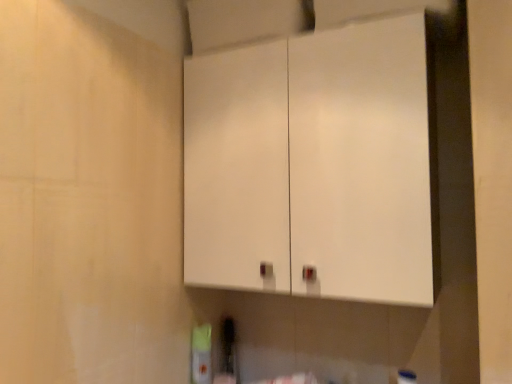
What do you see at coordinates (312, 165) in the screenshot? I see `white matte cabinet at upper center` at bounding box center [312, 165].

In the scene shown: Measure the distance between point [271,253] and camera.

The distance of point [271,253] from camera is 39.02 inches.

The height and width of the screenshot is (384, 512). What are the coordinates of `white matte cabinet at upper center` in the screenshot? It's located at [x=312, y=165].

Find the location of a particular element. This screenshot has width=512, height=384. white matte cabinet at upper center is located at coordinates point(312,165).